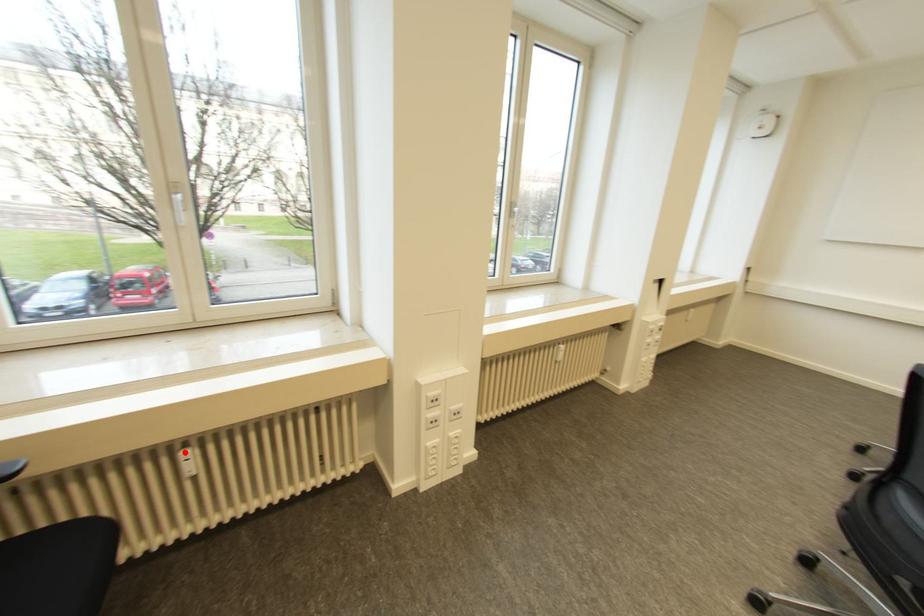
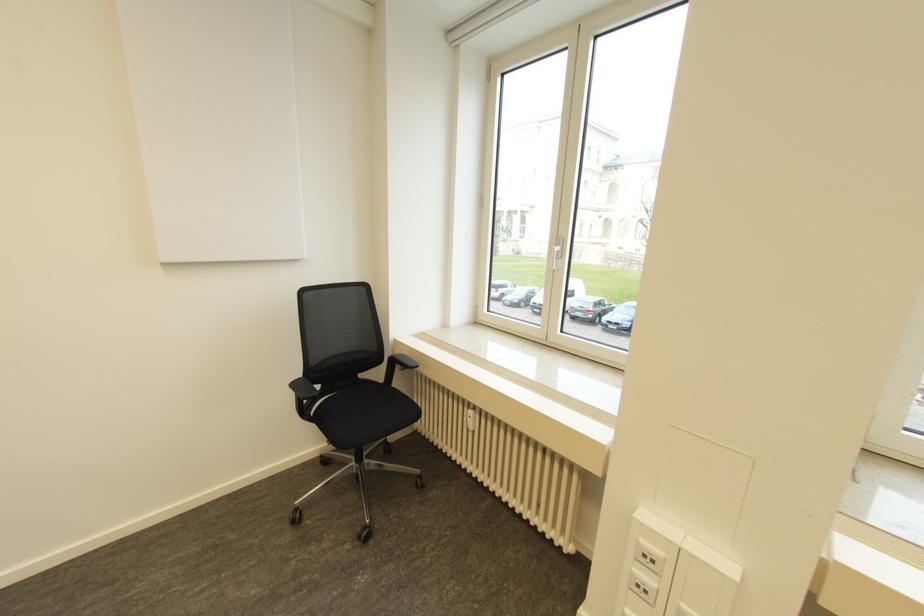
Question: I am providing you with two images of the same scene from different viewpoints. A red point is marked on the first image. At the location where the point appears in image 1, is it still visible in image 2?

Choices:
 (A) Yes
 (B) No

Answer: (A)